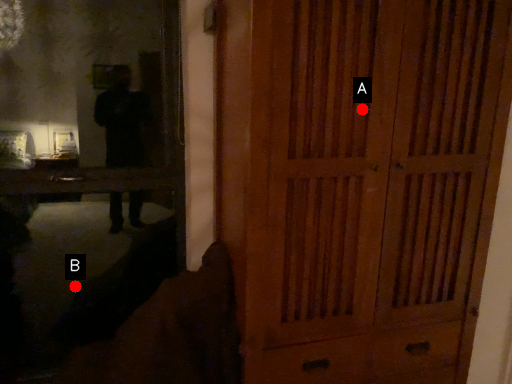
Question: Two points are circled on the image, labeled by A and B beside each circle. Which of the following is the closest to the observer?

Choices:
 (A) A is closer
 (B) B is closer

Answer: (A)